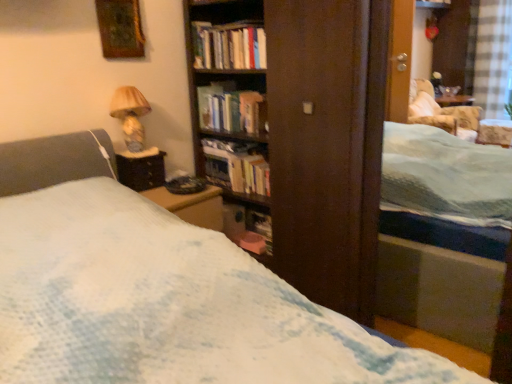
Question: Which direction should I rotate to look at hardcover books at center, which ranks as the third book in bottom-to-top order?

Choices:
 (A) left
 (B) right

Answer: (A)

Question: Would you consider hardcover book at center, which is the first book from bottom to top, to be distant from wooden table at left?

Choices:
 (A) yes
 (B) no

Answer: (B)

Question: Does hardcover book at center, which ranks as the third book in top-to-bottom order, have a greater height compared to wooden table at left?

Choices:
 (A) no
 (B) yes

Answer: (B)

Question: Does hardcover book at center, which ranks as the third book in top-to-bottom order, have a lesser width compared to wooden table at left?

Choices:
 (A) yes
 (B) no

Answer: (B)

Question: Are hardcover book at center, which is the first book from bottom to top, and wooden table at left beside each other?

Choices:
 (A) no
 (B) yes

Answer: (A)

Question: Is wooden table at left located within hardcover book at center, which is the first book from bottom to top?

Choices:
 (A) no
 (B) yes

Answer: (A)

Question: Considering the relative sizes of hardcover book at center, which is the first book from bottom to top, and wooden table at left in the image provided, is hardcover book at center, which is the first book from bottom to top, smaller than wooden table at left?

Choices:
 (A) yes
 (B) no

Answer: (B)

Question: Is hardcover books at center, which is counted as the first book, starting from the top, turned away from matte beige lampshade at upper left?

Choices:
 (A) no
 (B) yes

Answer: (A)

Question: Would you consider hardcover books at center, which is counted as the first book, starting from the top, to be distant from matte beige lampshade at upper left?

Choices:
 (A) no
 (B) yes

Answer: (A)

Question: Can you confirm if hardcover books at center, which ranks as the third book in bottom-to-top order, is shorter than matte beige lampshade at upper left?

Choices:
 (A) yes
 (B) no

Answer: (A)

Question: Is hardcover books at center, which is counted as the first book, starting from the top, closer to camera compared to matte beige lampshade at upper left?

Choices:
 (A) no
 (B) yes

Answer: (A)

Question: Is hardcover books at center, which ranks as the third book in bottom-to-top order, smaller than matte beige lampshade at upper left?

Choices:
 (A) yes
 (B) no

Answer: (A)

Question: Is hardcover books at center, which is counted as the first book, starting from the top, at the right side of matte beige lampshade at upper left?

Choices:
 (A) no
 (B) yes

Answer: (B)

Question: Is hardcover book at center, which ranks as the third book in top-to-bottom order, aimed at hardcover books at center, which appears as the 2th book when viewed from the top?

Choices:
 (A) no
 (B) yes

Answer: (A)